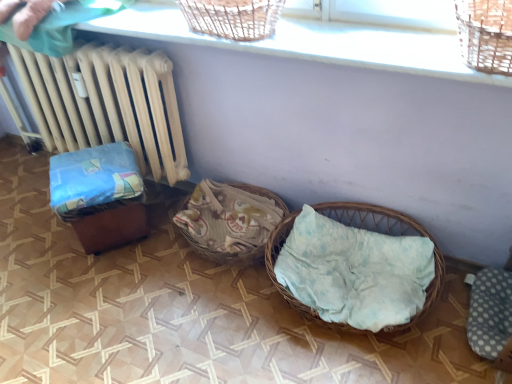
Question: Is woven wicker basket at lower right oriented away from wooden brown baby carriage at left?

Choices:
 (A) yes
 (B) no

Answer: (B)

Question: Is wooden brown baby carriage at left completely or partially inside woven wicker basket at lower right?

Choices:
 (A) no
 (B) yes

Answer: (A)

Question: From a real-world perspective, is woven wicker basket at lower right on top of wooden brown baby carriage at left?

Choices:
 (A) yes
 (B) no

Answer: (B)

Question: From a real-world perspective, is woven wicker basket at lower right below wooden brown baby carriage at left?

Choices:
 (A) no
 (B) yes

Answer: (B)

Question: Is woven wicker basket at lower right thinner than wooden brown baby carriage at left?

Choices:
 (A) no
 (B) yes

Answer: (A)

Question: From the image's perspective, is wooden brown baby carriage at left located above or below woven wicker basket at lower right?

Choices:
 (A) below
 (B) above

Answer: (B)

Question: Considering the relative positions of wooden brown baby carriage at left and woven wicker basket at lower right in the image provided, is wooden brown baby carriage at left to the left or to the right of woven wicker basket at lower right?

Choices:
 (A) right
 (B) left

Answer: (B)

Question: From a real-world perspective, relative to woven wicker basket at lower right, is wooden brown baby carriage at left vertically above or below?

Choices:
 (A) below
 (B) above

Answer: (B)

Question: Looking at the image, does wooden brown baby carriage at left seem bigger or smaller compared to woven wicker basket at lower right?

Choices:
 (A) big
 (B) small

Answer: (B)

Question: From a real-world perspective, is gray dotted fabric at lower right above or below beige wood radiator at left?

Choices:
 (A) below
 (B) above

Answer: (A)

Question: From the image's perspective, is gray dotted fabric at lower right located above or below beige wood radiator at left?

Choices:
 (A) below
 (B) above

Answer: (A)

Question: Would you say gray dotted fabric at lower right is to the left or to the right of beige wood radiator at left in the picture?

Choices:
 (A) left
 (B) right

Answer: (B)

Question: Would you say gray dotted fabric at lower right is inside or outside beige wood radiator at left?

Choices:
 (A) outside
 (B) inside

Answer: (A)

Question: From the image's perspective, is woven wicker basket at lower right positioned above or below woven wood basket at upper center?

Choices:
 (A) above
 (B) below

Answer: (B)

Question: Is woven wicker basket at lower right inside or outside of woven wood basket at upper center?

Choices:
 (A) outside
 (B) inside

Answer: (A)